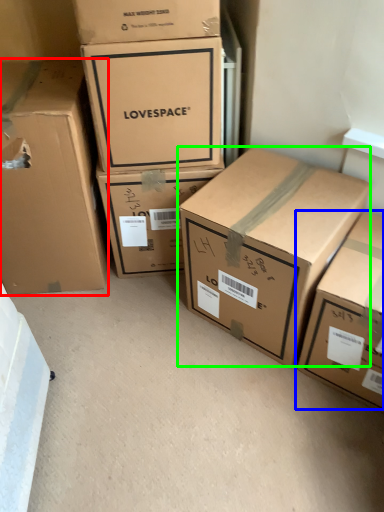
Question: Which is farther away from box (highlighted by a red box)? box (highlighted by a blue box) or box (highlighted by a green box)?

Choices:
 (A) box
 (B) box

Answer: (A)